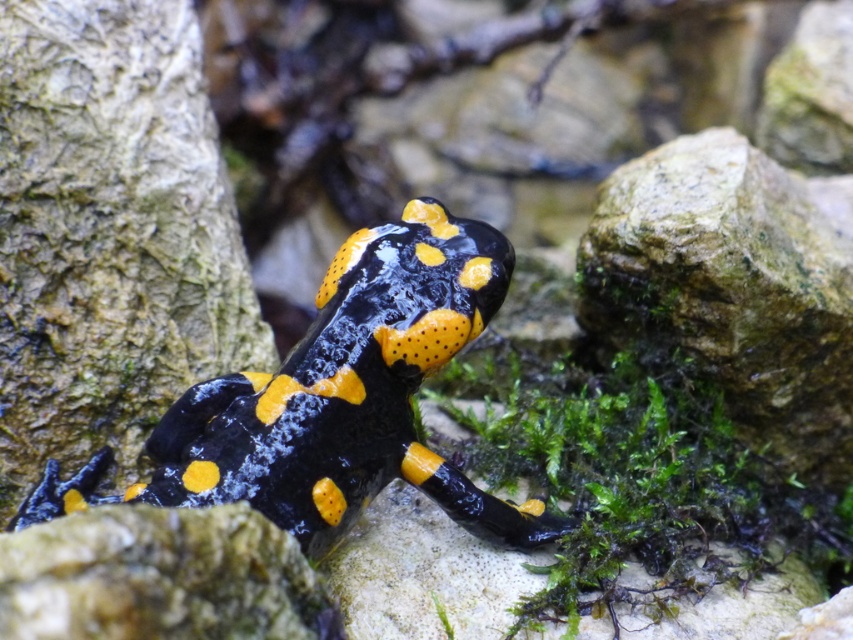
You are a researcher studying the fire salamander in its natural habitat. You notice two points marked on your map at coordinates point (345, 451) and point (816, 298). If you are standing at the salamander and looking towards the background, which point is closer to you?

Point (345, 451) is in front of point (816, 298), so the point closer to you would be point (345, 451).

You are a wildlife photographer aiming to capture the black matte salamander at center. To ensure the smooth rock at lower center is visible in the background, should you adjust your camera focus to a wider or narrower depth of field?

To ensure the smooth rock at lower center is visible in the background while focusing on the black matte salamander at center, you should use a wider depth of field. A wider depth of field keeps both the foreground subject and background elements in focus, which is necessary here since the black matte salamander at center is positioned over the smooth rock at lower center.